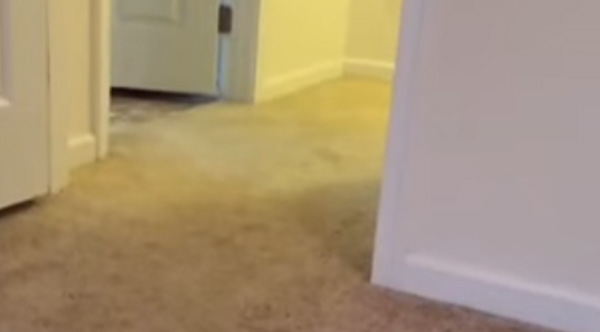
In order to click on inside room in this screenshot , I will do `click(138, 300)`.